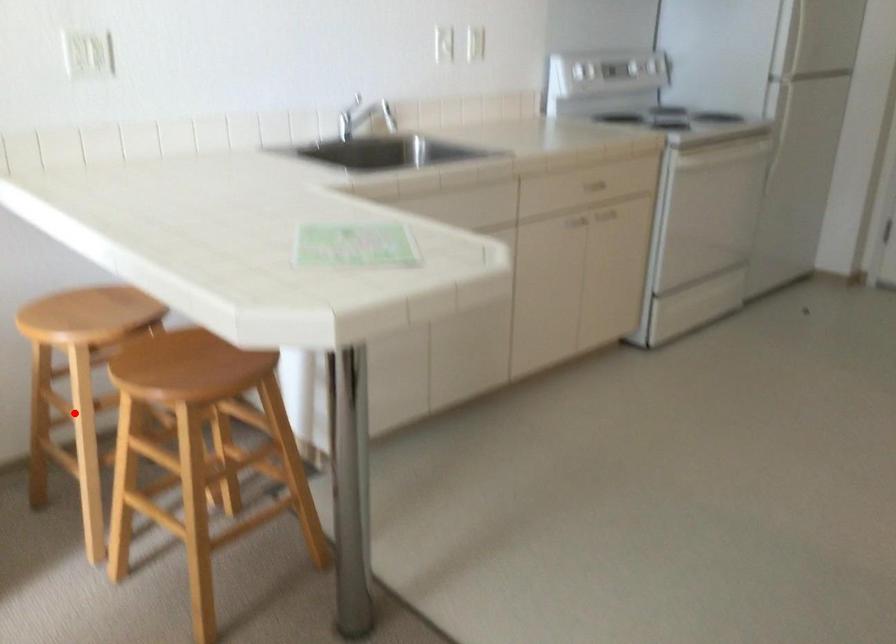
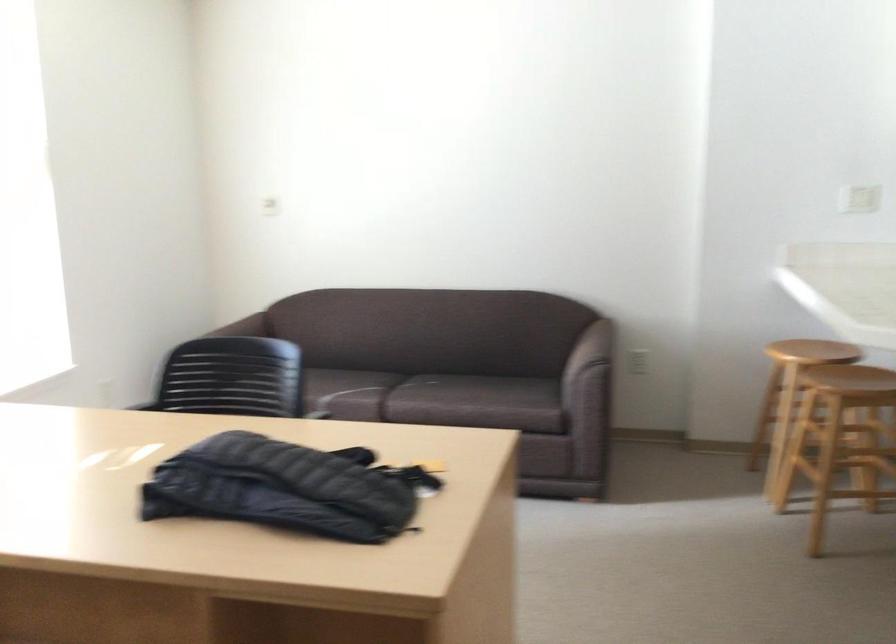
Locate, in the second image, the point that corresponds to the highlighted location in the first image.

(789, 395)